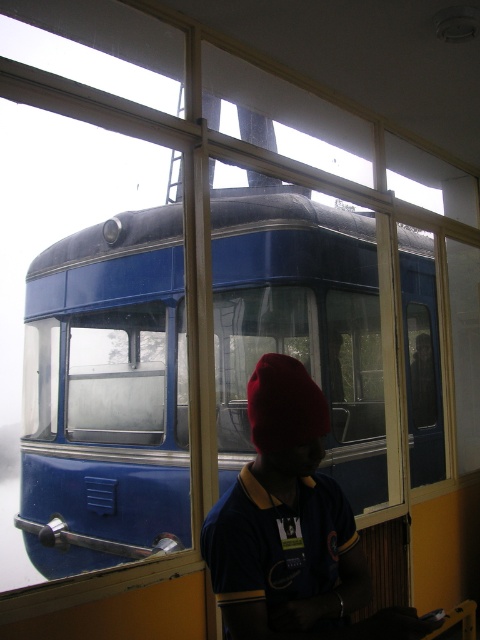
You are a maintenance worker who needs to reach the blue metallic tram at center from your current position. The minimum safe distance required to operate the tram safely is 3 meters. Is your current distance sufficient?

The distance between you and the blue metallic tram at center is 3.31 meters, which exceeds the minimum safe distance of 3 meters. Therefore, your current distance is sufficient for safe operation.

You are standing at the cable car station and want to take a photo of the two points marked in the image. Which point, point (216, 225) or point (286, 452), is closer to your camera when taking the photo?

Point (286, 452) is closer to the camera because it is less further away than point (216, 225).

You are standing at the entrance of the cable car station and want to board the blue metallic tram at center. According to the coordinates provided, is the tram positioned to your left or right side?

The blue metallic tram at center is located at coordinates point (106, 394). Since the x coordinate is 0.616, which is closer to the right side of the image, the tram is positioned to your right side.